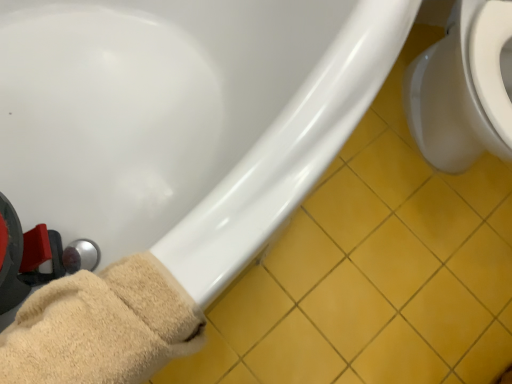
Question: Is white glossy toilet at right at the right side of yellow tile at lower right?

Choices:
 (A) no
 (B) yes

Answer: (B)

Question: From a real-world perspective, is white glossy toilet at right physically above yellow tile at lower right?

Choices:
 (A) no
 (B) yes

Answer: (B)

Question: Does white glossy toilet at right appear on the left side of yellow tile at lower right?

Choices:
 (A) no
 (B) yes

Answer: (A)

Question: Is white glossy toilet at right facing away from yellow tile at lower right?

Choices:
 (A) yes
 (B) no

Answer: (B)

Question: From a real-world perspective, does white glossy toilet at right sit lower than yellow tile at lower right?

Choices:
 (A) yes
 (B) no

Answer: (B)

Question: Looking at their shapes, would you say white glossy bathtub at lower left is wider or thinner than beige fuzzy towel at lower left?

Choices:
 (A) wide
 (B) thin

Answer: (A)

Question: From a real-world perspective, relative to beige fuzzy towel at lower left, is white glossy bathtub at lower left vertically above or below?

Choices:
 (A) above
 (B) below

Answer: (B)

Question: Does point (106, 127) appear closer or farther from the camera than point (81, 354)?

Choices:
 (A) closer
 (B) farther

Answer: (B)

Question: Would you say white glossy bathtub at lower left is to the left or to the right of beige fuzzy towel at lower left in the picture?

Choices:
 (A) left
 (B) right

Answer: (B)

Question: In terms of height, does white glossy toilet at right look taller or shorter compared to yellow tile at lower right?

Choices:
 (A) short
 (B) tall

Answer: (B)

Question: From a real-world perspective, relative to yellow tile at lower right, is white glossy toilet at right vertically above or below?

Choices:
 (A) above
 (B) below

Answer: (A)

Question: Considering the positions of white glossy toilet at right and yellow tile at lower right in the image, is white glossy toilet at right bigger or smaller than yellow tile at lower right?

Choices:
 (A) small
 (B) big

Answer: (B)

Question: Considering their positions, is white glossy toilet at right located in front of or behind yellow tile at lower right?

Choices:
 (A) front
 (B) behind

Answer: (A)

Question: From the image's perspective, is beige fuzzy towel at lower left located above or below white glossy toilet at right?

Choices:
 (A) below
 (B) above

Answer: (A)

Question: Is point (117, 283) closer or farther from the camera than point (509, 142)?

Choices:
 (A) farther
 (B) closer

Answer: (B)